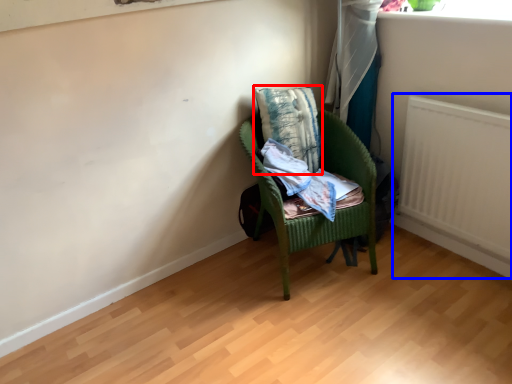
Question: Which object is further to the camera taking this photo, pillow (highlighted by a red box) or radiator (highlighted by a blue box)?

Choices:
 (A) pillow
 (B) radiator

Answer: (A)